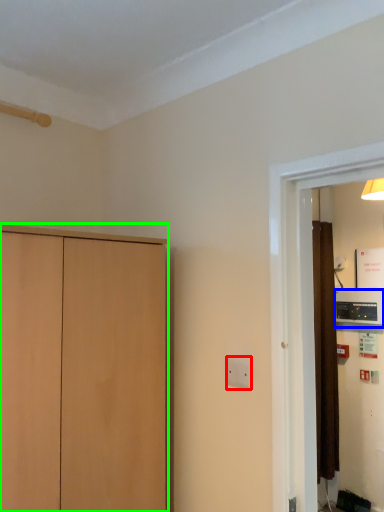
Question: Which object is the farthest from electric outlet (highlighted by a red box)? Choose among these: appliance (highlighted by a blue box) or cupboard (highlighted by a green box).

Choices:
 (A) appliance
 (B) cupboard

Answer: (A)